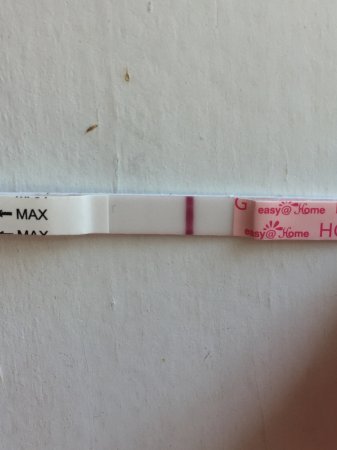
Where is `white wall`? white wall is located at coordinates click(199, 401).